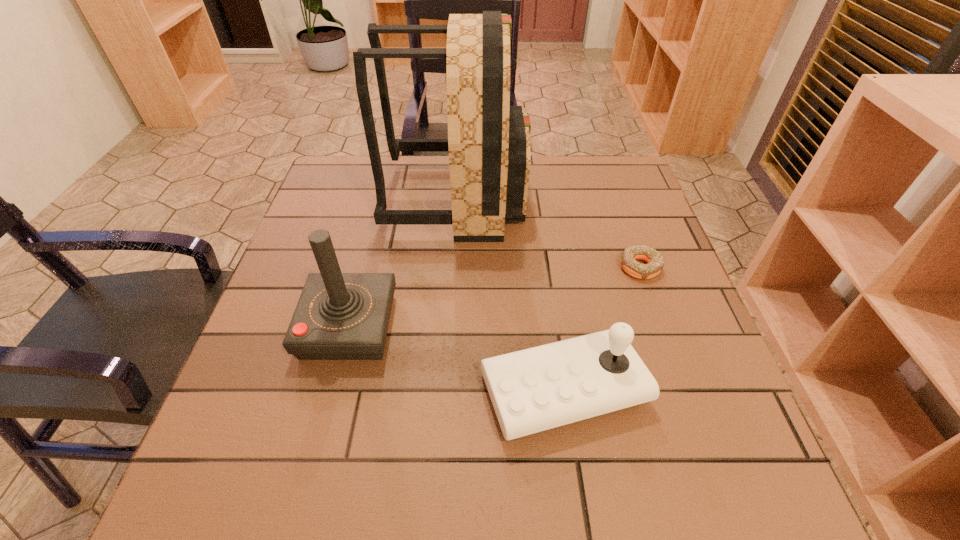
This screenshot has height=540, width=960. Identify the location of free location that satisfies the following two spatial constraints: 1. on the front face of the third nearest object; 2. on the right side of the backpack. (452, 268).

This screenshot has width=960, height=540. In order to click on free space that satisfies the following two spatial constraints: 1. on the rectangular base of the right joystick; 2. on the left side of the taller joystick in this screenshot , I will do `click(333, 389)`.